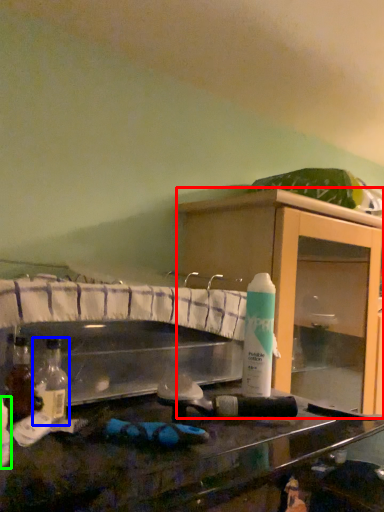
Question: Considering the real-world distances, which object is closest to cabinetry (highlighted by a red box)? bottle (highlighted by a blue box) or bottle (highlighted by a green box).

Choices:
 (A) bottle
 (B) bottle

Answer: (A)